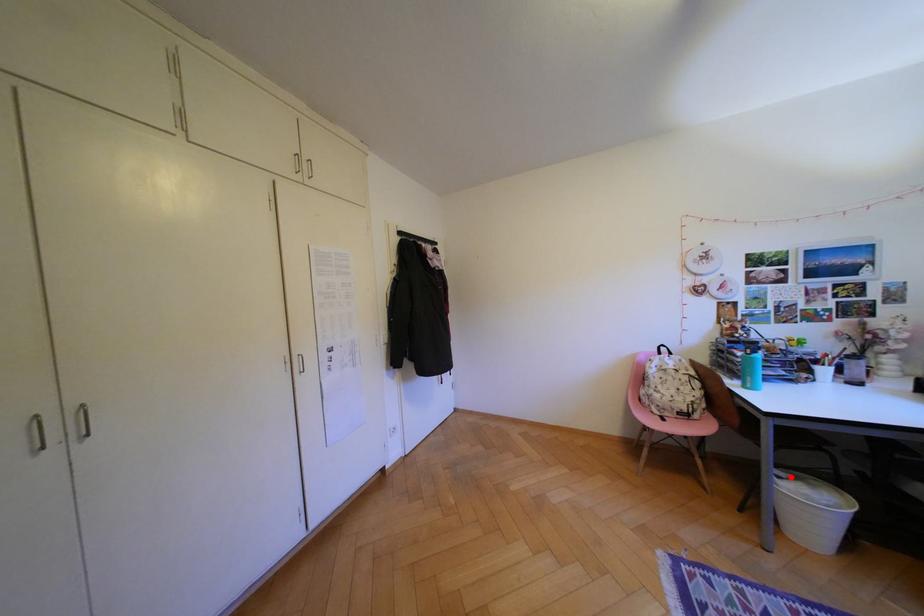
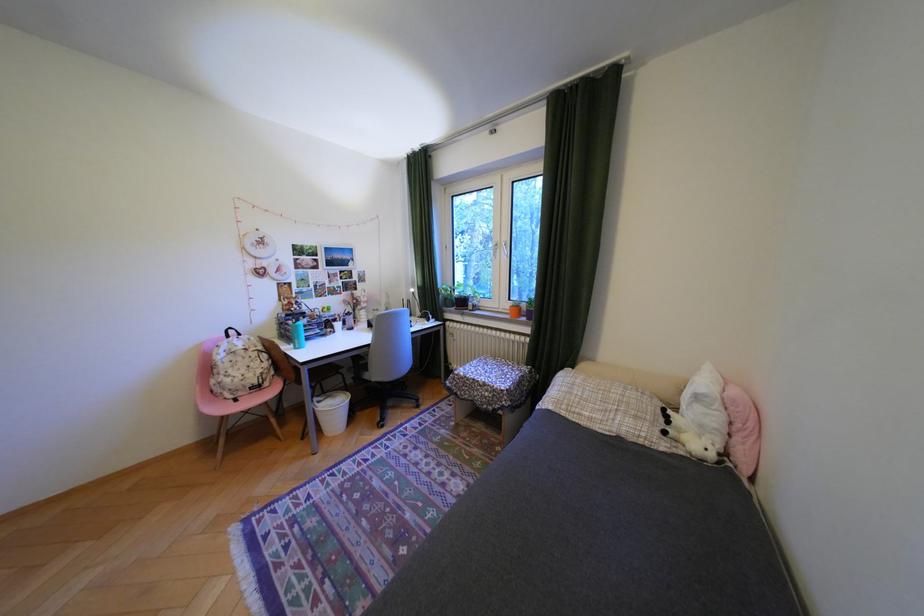
Locate, in the second image, the point that corresponds to the highlighted location in the first image.

(331, 402)